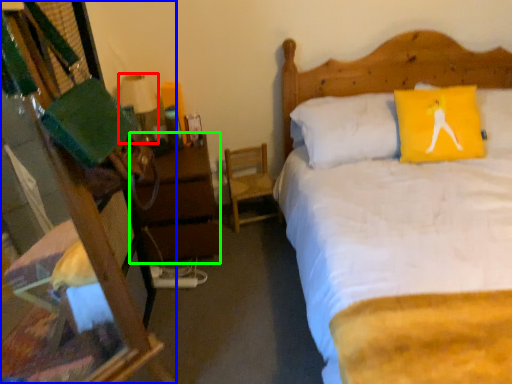
Question: Considering the real-world distances, which object is farthest from lamp (highlighted by a red box)? desk (highlighted by a blue box) or nightstand (highlighted by a green box)?

Choices:
 (A) desk
 (B) nightstand

Answer: (A)